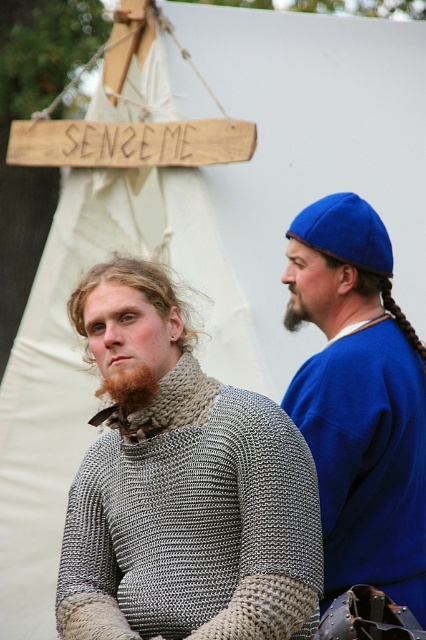
Question: Estimate the real-world distances between objects in this image. Which object is closer to the brownwoollybeard at right?

Choices:
 (A) matte blue cap at upper right
 (B) reddish-brown hair at left

Answer: (A)

Question: Can you confirm if reddish-brown hair at left is thinner than brownwoollybeard at right?

Choices:
 (A) no
 (B) yes

Answer: (A)

Question: Can you confirm if chainmail at center is positioned to the left of blue braided hair at right?

Choices:
 (A) no
 (B) yes

Answer: (B)

Question: Which object appears closest to the camera in this image?

Choices:
 (A) chainmail at center
 (B) reddish-brown hair at left

Answer: (A)

Question: Which object is the closest to the chainmail at center?

Choices:
 (A) brownwoollybeard at right
 (B) reddish-brown hair at left

Answer: (B)

Question: Is chainmail at center positioned at the back of blue braided hair at right?

Choices:
 (A) yes
 (B) no

Answer: (B)